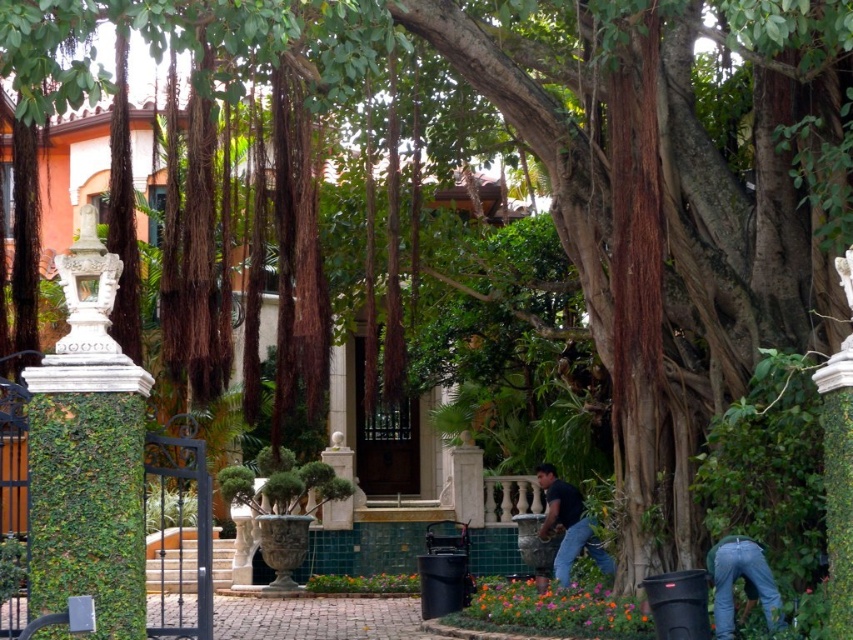
Which is behind, point (761, 604) or point (590, 532)?

Point (590, 532)

Is denim jeans at lower right wider than dark blue t-shirt at lower center?

Incorrect, denim jeans at lower right's width does not surpass dark blue t-shirt at lower center's.

Identify the location of denim jeans at lower right. The height and width of the screenshot is (640, 853). (743, 582).

Find the location of a particular element. The width and height of the screenshot is (853, 640). denim jeans at lower right is located at coordinates (743, 582).